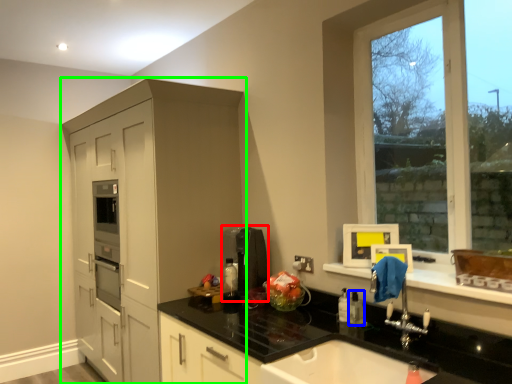
Question: Considering the real-world distances, which object is closest to coffee machine (highlighted by a red box)? toiletry (highlighted by a blue box) or cabinetry (highlighted by a green box).

Choices:
 (A) toiletry
 (B) cabinetry

Answer: (A)